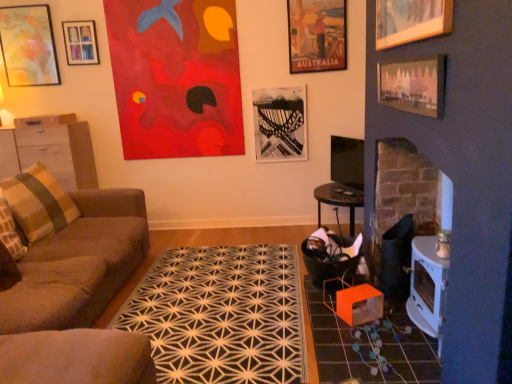
Question: From the image's perspective, is matte wooden picture frame at upper left, positioned as the third picture frame in back-to-front order, located above or below brown fabric couch at left?

Choices:
 (A) below
 (B) above

Answer: (B)

Question: In the image, is matte wooden picture frame at upper left, the 4th picture frame from the front, on the left side or the right side of brown fabric couch at left?

Choices:
 (A) left
 (B) right

Answer: (A)

Question: Estimate the real-world distances between objects in this image. Which object is farther from the orange cardboard box at lower right?

Choices:
 (A) matte wooden picture frame at upper left, the 6th picture frame in the right-to-left sequence
 (B) black glossy tv at center
 (C) brown fabric couch at left
 (D) black geometric rug at center
 (E) pink paper picture frame at upper right, arranged as the first picture frame when viewed from the right

Answer: (A)

Question: Based on their relative distances, which object is nearer to the matte paper poster at upper center, the 4th picture frame positioned from the back?

Choices:
 (A) black geometric rug at center
 (B) black and white photograph at center, the sixth picture frame in the front-to-back sequence
 (C) brown wood cabinet at left
 (D) plaid fabric pillow at left
 (E) wooden drawer at left

Answer: (B)